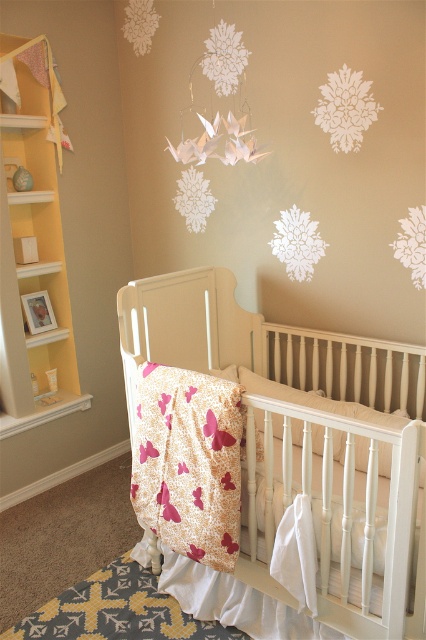
Which is in front, point (239, 596) or point (353, 404)?

Point (239, 596) is more forward.

Can you confirm if white wood crib at center is positioned to the right of white soft pillow at center?

In fact, white wood crib at center is to the left of white soft pillow at center.

Which is behind, point (342, 595) or point (278, 384)?

Point (278, 384)

The width and height of the screenshot is (426, 640). Identify the location of white wood crib at center. (319, 525).

What do you see at coordinates (319, 525) in the screenshot? The height and width of the screenshot is (640, 426). I see `white wood crib at center` at bounding box center [319, 525].

Is white wood crib at center taller than yellow wood bookshelf at left?

No, white wood crib at center is not taller than yellow wood bookshelf at left.

Describe the element at coordinates (319, 525) in the screenshot. I see `white wood crib at center` at that location.

Where is `white wood crib at center`? The width and height of the screenshot is (426, 640). white wood crib at center is located at coordinates (319, 525).

Is yellow wood bookshelf at left wider than white soft pillow at center?

In fact, yellow wood bookshelf at left might be narrower than white soft pillow at center.

Based on the photo, is yellow wood bookshelf at left above white soft pillow at center?

Yes.

Describe the element at coordinates (32, 243) in the screenshot. I see `yellow wood bookshelf at left` at that location.

In order to click on yellow wood bookshelf at left in this screenshot , I will do `click(32, 243)`.